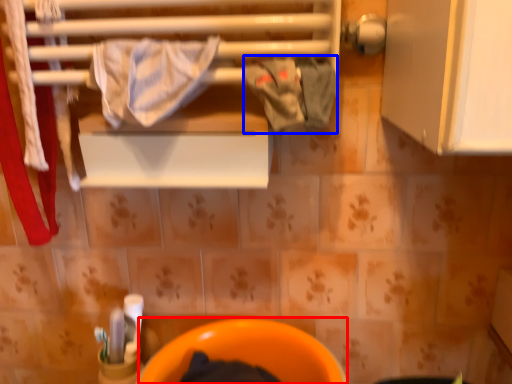
Question: Which object is closer to the camera taking this photo, toilet bowl (highlighted by a red box) or clothing (highlighted by a blue box)?

Choices:
 (A) toilet bowl
 (B) clothing

Answer: (B)